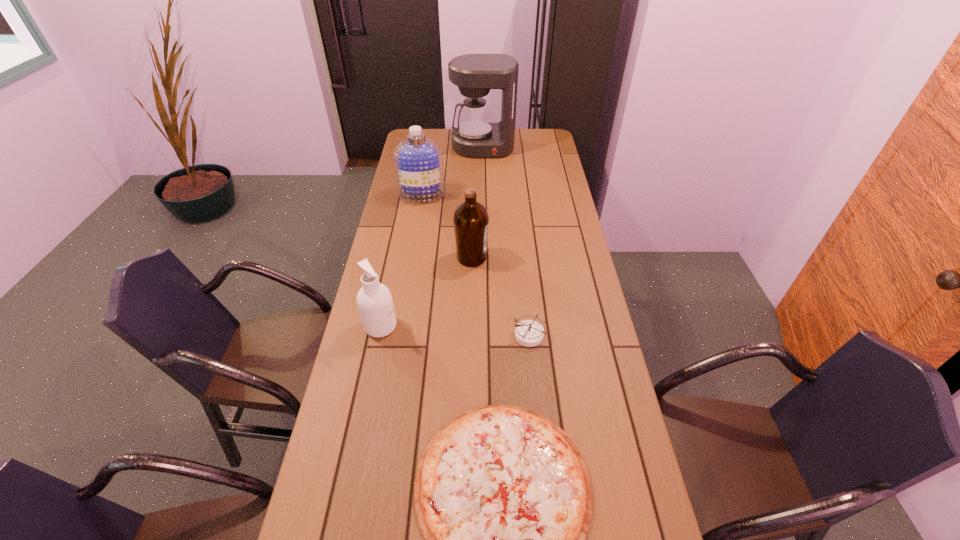
Where is `free space located 0.350m on the front label of the nearer cleansing agent`? This screenshot has width=960, height=540. free space located 0.350m on the front label of the nearer cleansing agent is located at coordinates (510, 326).

Locate an element on the screen. The image size is (960, 540). free spot located 0.120m on the right of the second shortest object is located at coordinates coord(586,335).

Where is `object located in the far edge section of the desktop`? object located in the far edge section of the desktop is located at coordinates (476, 136).

In the image, there is a desktop. Identify the location of free space at the left edge. Image resolution: width=960 pixels, height=540 pixels. (409, 287).

The image size is (960, 540). In order to click on vacant space at the right edge of the desktop in this screenshot , I will do `click(566, 422)`.

This screenshot has width=960, height=540. In the image, there is a desktop. What are the coordinates of `free space at the far left corner` in the screenshot? It's located at [439, 135].

Locate an element on the screen. free region at the far right corner of the desktop is located at coordinates (549, 132).

Identify the location of free space between the taller cleansing agent and the nearer cleansing agent. (401, 261).

At what (x,y) coordinates should I click in order to perform the action: click on free area in between the shorter cleansing agent and the taller cleansing agent. Please return your answer as a coordinate pair (x, y). This screenshot has height=540, width=960. Looking at the image, I should click on (401, 261).

The width and height of the screenshot is (960, 540). In order to click on free space between the shorter cleansing agent and the tallest object in this screenshot , I will do `click(432, 237)`.